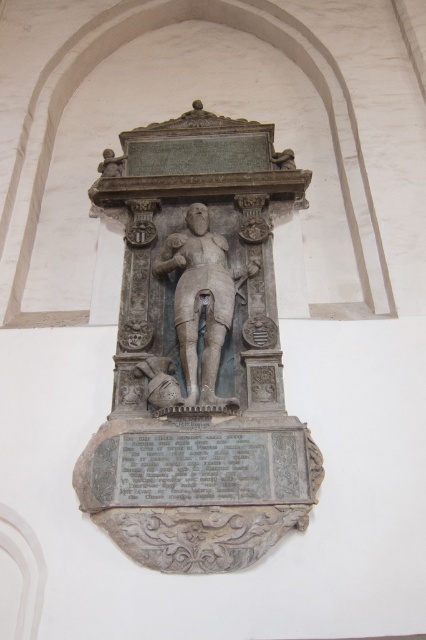
Which is in front, point (123, 435) or point (213, 308)?

Point (123, 435) is more forward.

Can you confirm if gray stone statue at center is positioned to the left of stone statue at center?

Yes, gray stone statue at center is to the left of stone statue at center.

Who is more distant from viewer, (143, 337) or (175, 300)?

The point (175, 300) is behind.

You are a GUI agent. You are given a task and a screenshot of the screen. Output one action in this format:
    pyautogui.click(x=<x>, y=<y>)
    Task: Click on the gray stone statue at center
    This screenshot has width=426, height=640.
    Given the screenshot: What is the action you would take?
    198,352